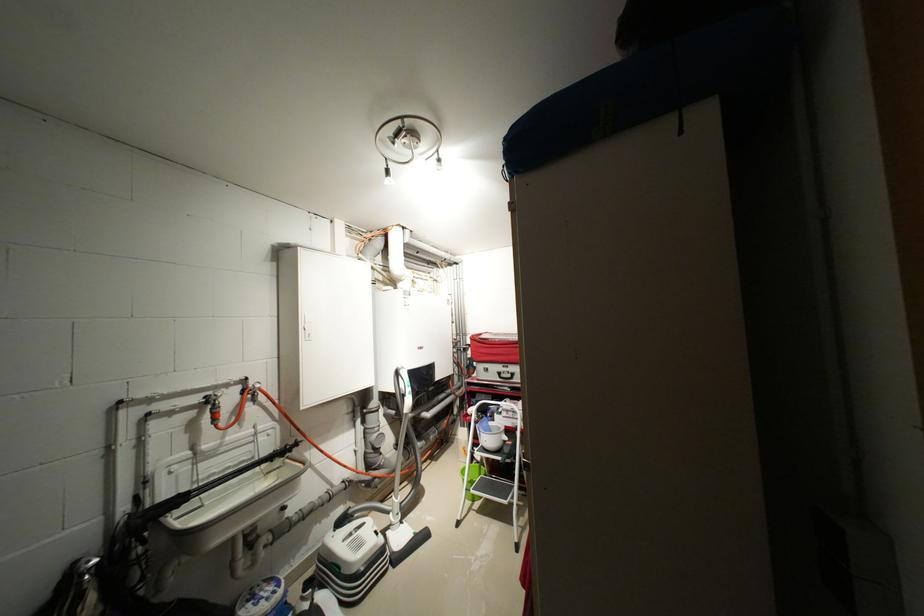
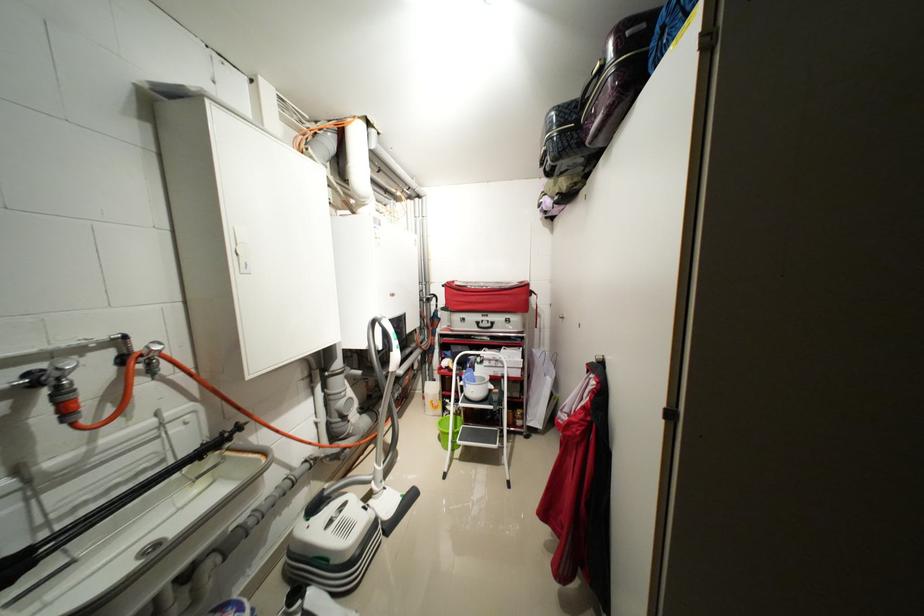
Find the pixel in the second image that matches (x=480, y=336) in the first image.

(455, 284)